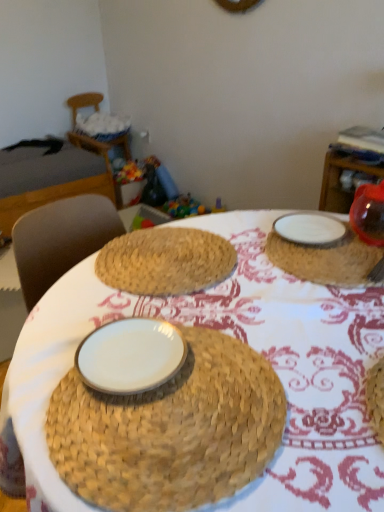
You are a GUI agent. You are given a task and a screenshot of the screen. Output one action in this format:
    pyautogui.click(x=<x>, y=<y>)
    Task: Click on the vacant region to the left of white ceramic plate at upper right
    
    Given the screenshot: What is the action you would take?
    pyautogui.click(x=215, y=264)